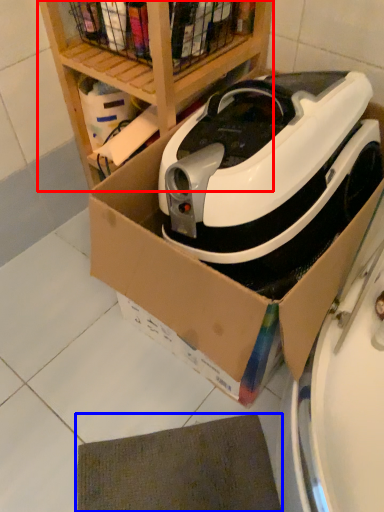
Question: Among these objects, which one is farthest to the camera, shelf (highlighted by a red box) or mat (highlighted by a blue box)?

Choices:
 (A) shelf
 (B) mat

Answer: (B)